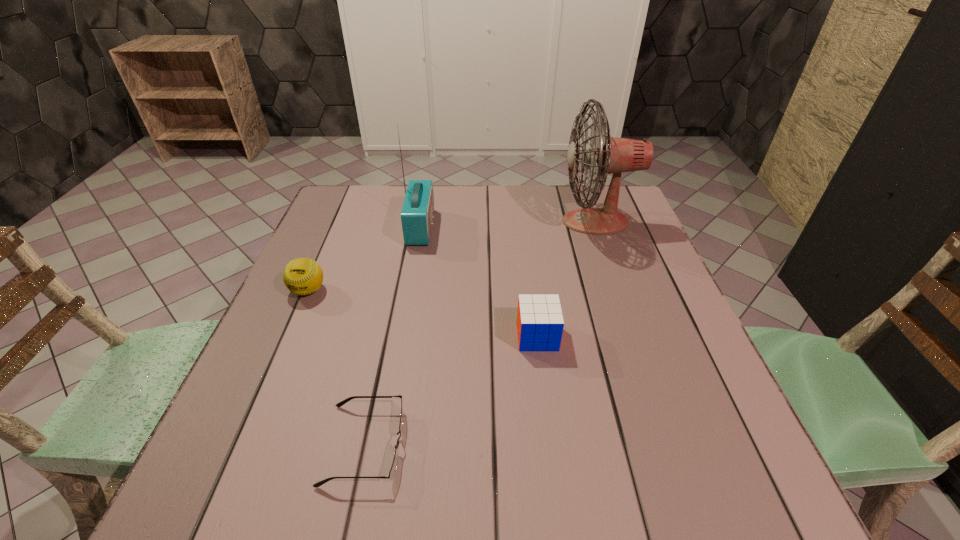
The image size is (960, 540). I want to click on object located in the right edge section of the desktop, so click(604, 155).

This screenshot has width=960, height=540. Identify the location of object at the far right corner. (604, 155).

You are a GUI agent. You are given a task and a screenshot of the screen. Output one action in this format:
    pyautogui.click(x=<x>, y=<y>)
    Task: Click on the vacant space at the far edge of the desktop
    Image resolution: width=960 pixels, height=540 pixels.
    Given the screenshot: What is the action you would take?
    pyautogui.click(x=396, y=193)

Identify the location of free spot at the near edge of the desktop. The width and height of the screenshot is (960, 540). (483, 503).

This screenshot has width=960, height=540. Identify the location of vacant area at the left edge. (328, 299).

I want to click on free space at the right edge, so click(x=631, y=246).

Where is `free space at the far left corner of the desktop`? The image size is (960, 540). free space at the far left corner of the desktop is located at coordinates (341, 212).

Image resolution: width=960 pixels, height=540 pixels. Identify the location of empty space that is in between the third farthest object and the radio receiver. (365, 259).

Image resolution: width=960 pixels, height=540 pixels. I want to click on unoccupied area between the second tallest object and the spectacles, so click(393, 336).

Identify the location of free area in between the softball and the nearest object. This screenshot has width=960, height=540. (336, 367).